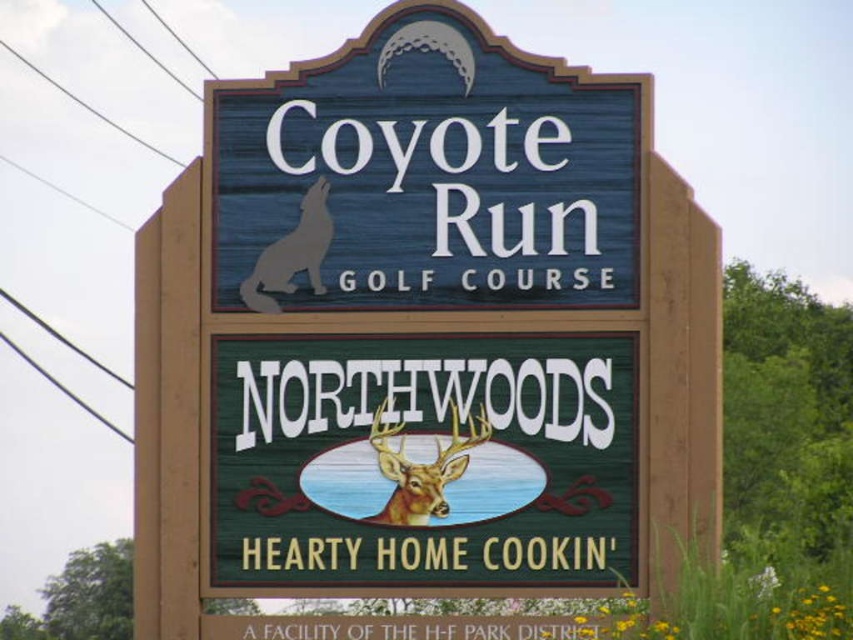
You are standing at the signboard for Coyote Run Golf Course and Northwoods Hearty Home Cookin. There is a point marked at coordinates (578, 211) on the signboard. If you want to place a new sticker exactly 120 meters away from the camera, would the current point be a suitable location?

The point at (578, 211) is currently 119.05 meters from the camera. Since 119.05 meters is slightly less than 120 meters, the point is not exactly 120 meters away. You would need to adjust the sticker placement to be slightly further away to reach the desired distance.